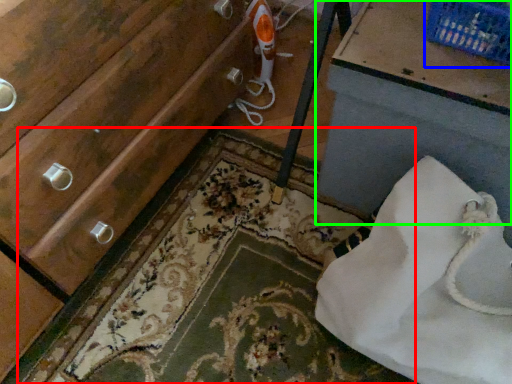
Question: Based on their relative distances, which object is nearer to bath mat (highlighted by a red box)? Choose from basket (highlighted by a blue box) and vanity (highlighted by a green box).

Choices:
 (A) basket
 (B) vanity

Answer: (B)